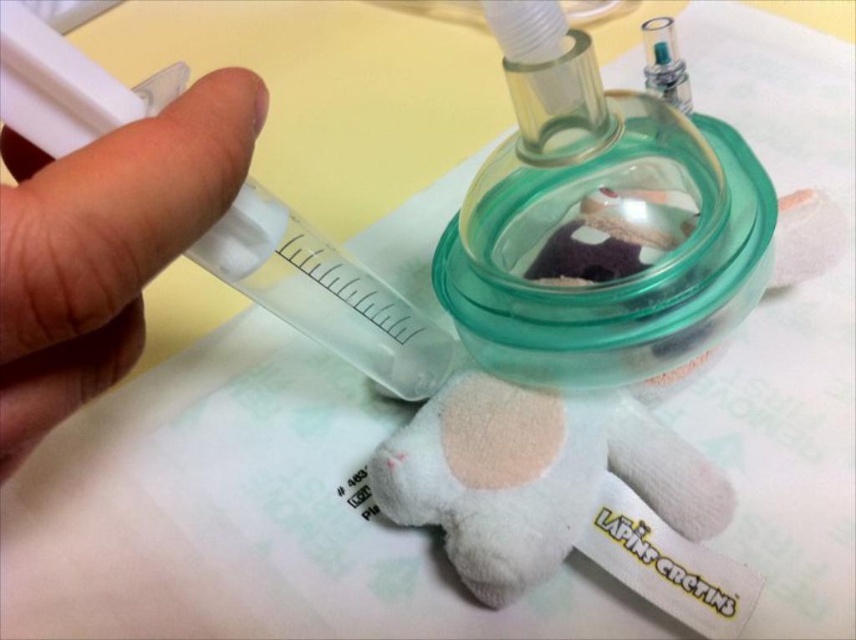
Question: Among these points, which one is nearest to the camera?

Choices:
 (A) (18, 88)
 (B) (1, 348)
 (C) (510, 240)

Answer: (B)

Question: Does transparent plastic syringe at left appear on the left side of transparent plastic syringe at upper left?

Choices:
 (A) yes
 (B) no

Answer: (A)

Question: Can you confirm if white plush toy at center is positioned to the left of transparent plastic syringe at left?

Choices:
 (A) no
 (B) yes

Answer: (A)

Question: Which object is the farthest from the white plush toy at center?

Choices:
 (A) transparent plastic syringe at upper left
 (B) transparent plastic syringe at left

Answer: (B)

Question: Among these objects, which one is nearest to the camera?

Choices:
 (A) white plush toy at center
 (B) transparent plastic syringe at upper left

Answer: (B)

Question: Can you confirm if white plush toy at center is thinner than transparent plastic syringe at left?

Choices:
 (A) yes
 (B) no

Answer: (B)